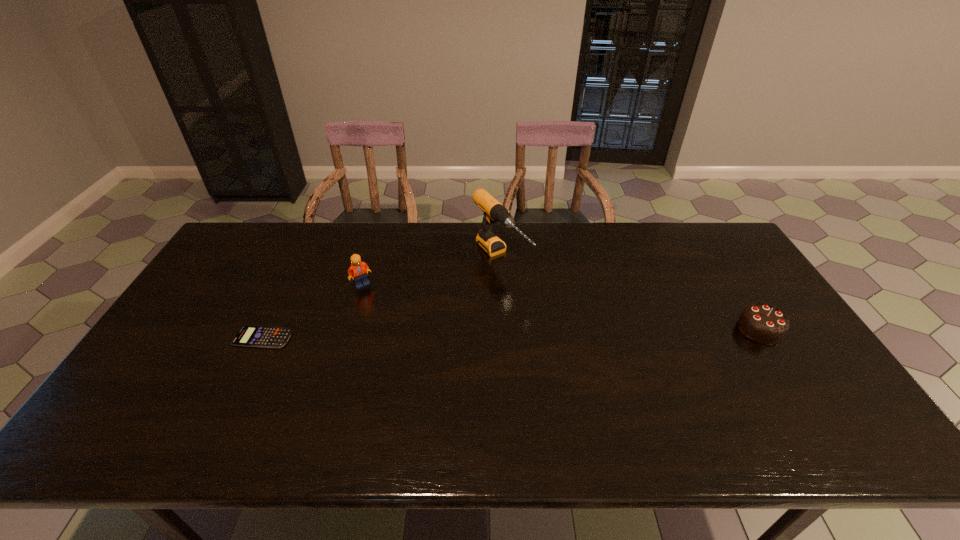
The width and height of the screenshot is (960, 540). In the image, there is a desktop. In order to click on vacant space at the left edge in this screenshot , I will do `click(234, 308)`.

Where is `vacant area at the far left corner`? This screenshot has height=540, width=960. vacant area at the far left corner is located at coordinates (232, 258).

This screenshot has height=540, width=960. I want to click on vacant space at the near left corner of the desktop, so click(156, 384).

At what (x,y) coordinates should I click in order to perform the action: click on free region at the far right corner of the desktop. Please return your answer as a coordinate pair (x, y). This screenshot has width=960, height=540. Looking at the image, I should click on (708, 258).

Find the location of `free space at the near right corner of the desktop`. free space at the near right corner of the desktop is located at coordinates (820, 386).

This screenshot has width=960, height=540. What are the coordinates of `vacant region between the leftmost object and the chocolate cake` in the screenshot? It's located at (512, 333).

Where is `free space between the shortest object and the third tallest object`? This screenshot has width=960, height=540. free space between the shortest object and the third tallest object is located at coordinates (512, 333).

Image resolution: width=960 pixels, height=540 pixels. In order to click on unoccupied area between the tallest object and the leftmost object in this screenshot , I will do click(x=382, y=298).

Identify the location of free area in between the rightmost object and the third object from right to left. The image size is (960, 540). (561, 307).

Find the location of a particular element. unoccupied area between the second object from right to left and the leftmost object is located at coordinates (382, 298).